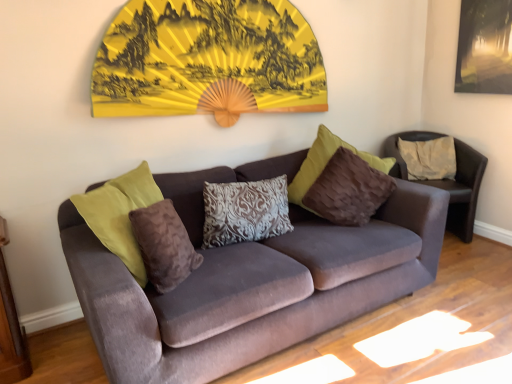
Question: From a real-world perspective, is brown velvety pillow at center, placed as the 1th pillow when sorted from front to back, physically above patterned fabric pillow at center, acting as the second pillow starting from the back?

Choices:
 (A) no
 (B) yes

Answer: (B)

Question: Would you consider brown velvety pillow at center, which ranks as the 1th pillow in left-to-right order, to be distant from patterned fabric pillow at center, positioned as the 2th pillow in right-to-left order?

Choices:
 (A) no
 (B) yes

Answer: (A)

Question: Is brown velvety pillow at center, which appears as the 3th pillow when viewed from the back, positioned beyond the bounds of patterned fabric pillow at center, the 2th pillow positioned from the front?

Choices:
 (A) yes
 (B) no

Answer: (A)

Question: From a real-world perspective, is brown velvety pillow at center, placed as the 1th pillow when sorted from front to back, physically below patterned fabric pillow at center, positioned as the 2th pillow in right-to-left order?

Choices:
 (A) no
 (B) yes

Answer: (A)

Question: Can you confirm if brown velvety pillow at center, which appears as the 3th pillow when viewed from the back, is taller than patterned fabric pillow at center, positioned as the 2th pillow in right-to-left order?

Choices:
 (A) no
 (B) yes

Answer: (B)

Question: In the image, is yellow paper fan at upper center on the left side or the right side of velvet couch at center?

Choices:
 (A) left
 (B) right

Answer: (A)

Question: From the image's perspective, relative to velvet couch at center, is yellow paper fan at upper center above or below?

Choices:
 (A) above
 (B) below

Answer: (A)

Question: Is yellow paper fan at upper center in front of or behind velvet couch at center in the image?

Choices:
 (A) front
 (B) behind

Answer: (B)

Question: From a real-world perspective, is yellow paper fan at upper center above or below velvet couch at center?

Choices:
 (A) below
 (B) above

Answer: (B)

Question: From the image's perspective, is patterned fabric pillow at center, the second pillow viewed from the left, located above or below velvet couch at center?

Choices:
 (A) below
 (B) above

Answer: (B)

Question: Considering the positions of patterned fabric pillow at center, positioned as the 2th pillow in right-to-left order, and velvet couch at center in the image, is patterned fabric pillow at center, positioned as the 2th pillow in right-to-left order, wider or thinner than velvet couch at center?

Choices:
 (A) thin
 (B) wide

Answer: (A)

Question: Is patterned fabric pillow at center, the second pillow viewed from the left, taller or shorter than velvet couch at center?

Choices:
 (A) tall
 (B) short

Answer: (B)

Question: Considering the positions of point click(231, 196) and point click(296, 206), is point click(231, 196) closer or farther from the camera than point click(296, 206)?

Choices:
 (A) farther
 (B) closer

Answer: (B)

Question: Relative to yellow paper fan at upper center, is velvet brown armchair at center in front or behind?

Choices:
 (A) behind
 (B) front

Answer: (A)

Question: From the image's perspective, is velvet brown armchair at center positioned above or below yellow paper fan at upper center?

Choices:
 (A) below
 (B) above

Answer: (A)